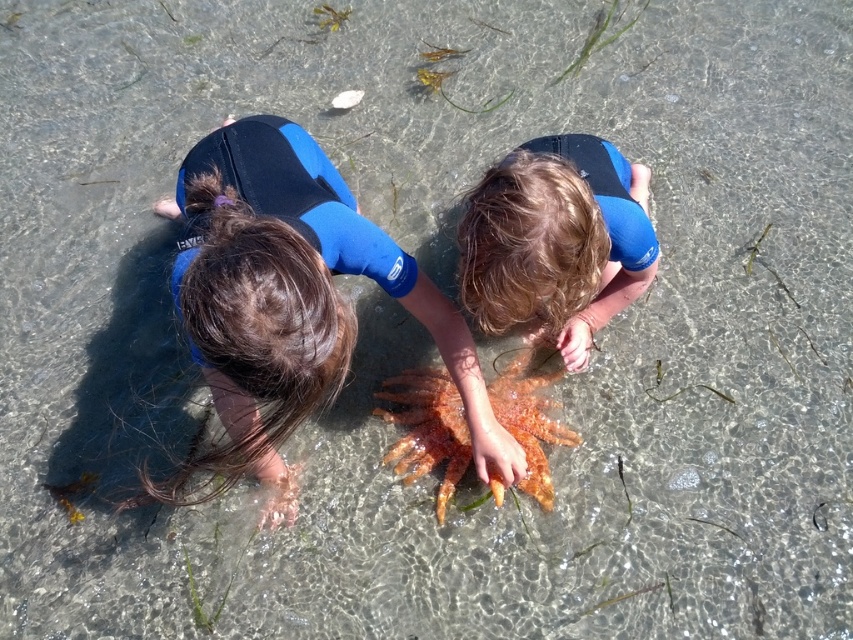
Question: Does orange rough starfish at center appear on the right side of blue neoprene wetsuit at upper center?

Choices:
 (A) no
 (B) yes

Answer: (A)

Question: Is blue neoprene wetsuit at center below blue neoprene wetsuit at upper center?

Choices:
 (A) no
 (B) yes

Answer: (B)

Question: Which of the following is the farthest from the observer?

Choices:
 (A) (450, 426)
 (B) (618, 211)

Answer: (A)

Question: Considering the real-world distances, which object is closest to the smooth blue wetsuit at center?

Choices:
 (A) blue neoprene wetsuit at center
 (B) blue neoprene wetsuit at upper center
 (C) orange rough starfish at center

Answer: (B)

Question: Is blue neoprene wetsuit at center above orange rough starfish at center?

Choices:
 (A) yes
 (B) no

Answer: (A)

Question: Which point appears farthest from the camera in this image?

Choices:
 (A) (606, 148)
 (B) (288, 504)

Answer: (A)